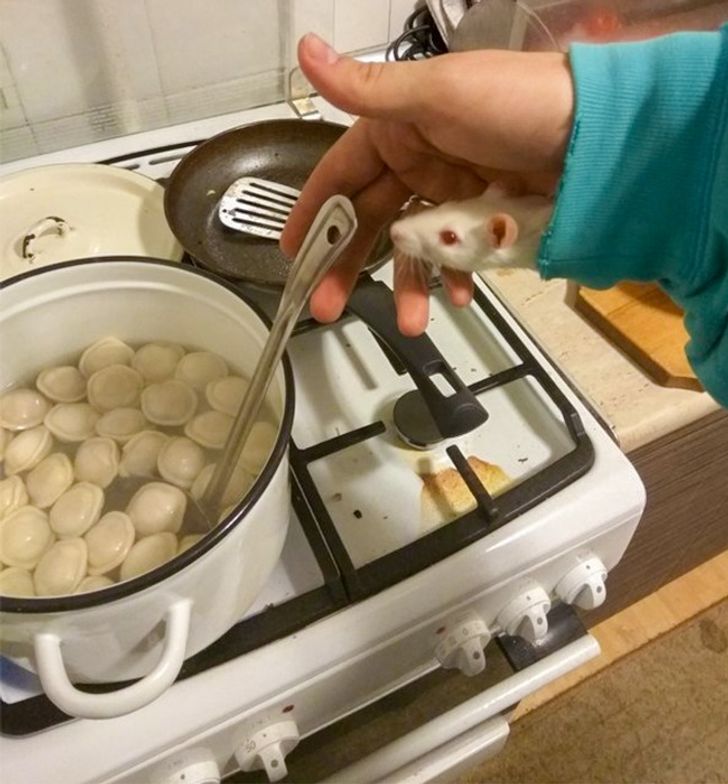
Locate an element on the screen. cutting board is located at coordinates (649, 310).